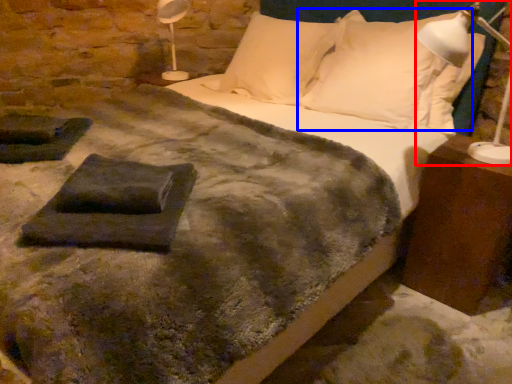
Question: Among these objects, which one is nearest to the camera, bedside lamp (highlighted by a red box) or pillow (highlighted by a blue box)?

Choices:
 (A) bedside lamp
 (B) pillow

Answer: (A)